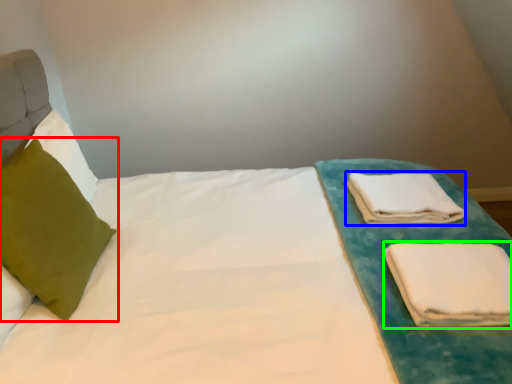
Question: Based on their relative distances, which object is nearer to pillow (highlighted by a red box)? Choose from cloth (highlighted by a blue box) and cloth (highlighted by a green box).

Choices:
 (A) cloth
 (B) cloth

Answer: (B)